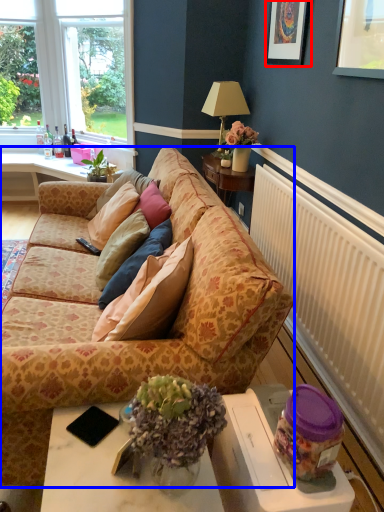
Question: Which object appears closest to the camera in this image, picture frame (highlighted by a red box) or studio couch (highlighted by a blue box)?

Choices:
 (A) picture frame
 (B) studio couch

Answer: (B)